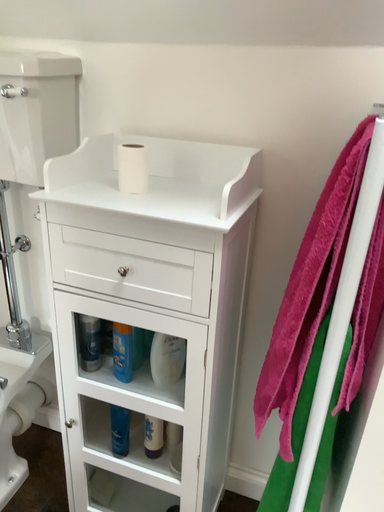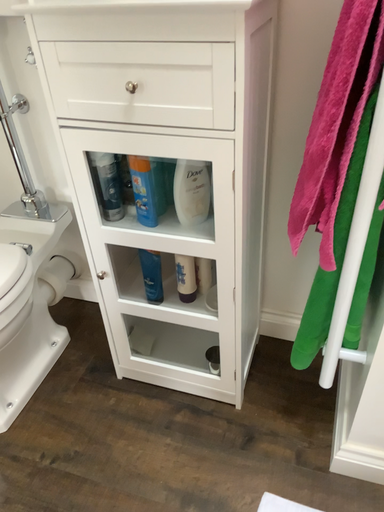
Question: Which way did the camera rotate in the video?

Choices:
 (A) rotated upward
 (B) rotated downward

Answer: (B)